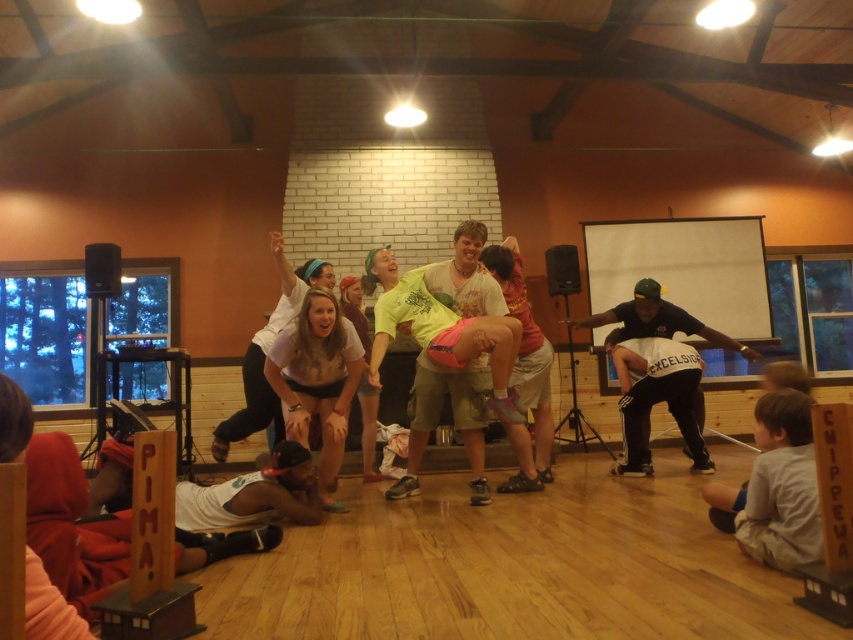
Question: Observing the image, what is the correct spatial positioning of gray cotton shirt at lower right in reference to black athletic pants at right?

Choices:
 (A) below
 (B) above

Answer: (A)

Question: Which of the following is the closest to the observer?

Choices:
 (A) (747, 524)
 (B) (675, 376)
 (C) (315, 352)

Answer: (A)

Question: Is white matte shorts at center further to the viewer compared to black athletic pants at right?

Choices:
 (A) yes
 (B) no

Answer: (B)

Question: Considering the real-world distances, which object is farthest from the gray cotton shirt at lower right?

Choices:
 (A) white matte shorts at center
 (B) black athletic pants at right

Answer: (A)

Question: Which of these objects is positioned farthest from the gray cotton shirt at lower right?

Choices:
 (A) white matte shorts at center
 (B) black athletic pants at right

Answer: (A)

Question: Does gray cotton shirt at lower right come behind white matte shorts at center?

Choices:
 (A) no
 (B) yes

Answer: (A)